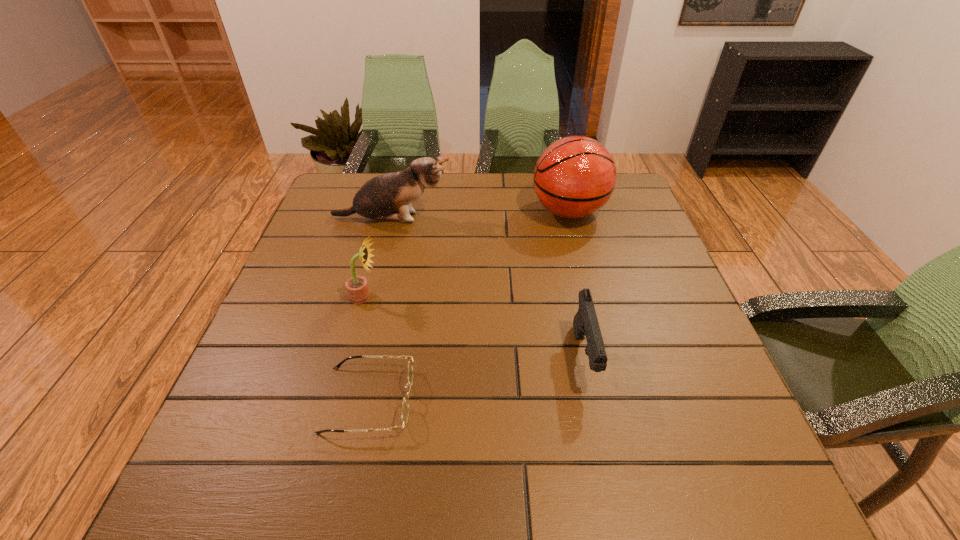
I want to click on vacant space at the right edge of the desktop, so click(x=609, y=243).

Locate an element on the screen. The width and height of the screenshot is (960, 540). free space at the near left corner is located at coordinates (266, 500).

Find the location of a particular element. The image size is (960, 540). free space at the far right corner is located at coordinates (632, 216).

You are a GUI agent. You are given a task and a screenshot of the screen. Output one action in this format:
    pyautogui.click(x=<x>, y=<y>)
    Task: Click on the vacant space that is in between the tallest object and the cat
    The height and width of the screenshot is (540, 960).
    Given the screenshot: What is the action you would take?
    pyautogui.click(x=480, y=215)

Locate an element on the screen. Image resolution: width=960 pixels, height=540 pixels. vacant point located between the cat and the basketball is located at coordinates (480, 215).

Find the location of `unoccupied position between the fourth tallest object and the basketball`. unoccupied position between the fourth tallest object and the basketball is located at coordinates (576, 285).

Identify the location of free area in between the basketball and the third farthest object. Image resolution: width=960 pixels, height=540 pixels. point(467,254).

Locate an element on the screen. vacant area that lies between the pistol and the shortest object is located at coordinates (476, 379).

What are the coordinates of `free space between the pistol and the cat` in the screenshot? It's located at (488, 288).

What are the coordinates of `vacant space that is in between the fourth tallest object and the shortest object` in the screenshot? It's located at (476, 379).